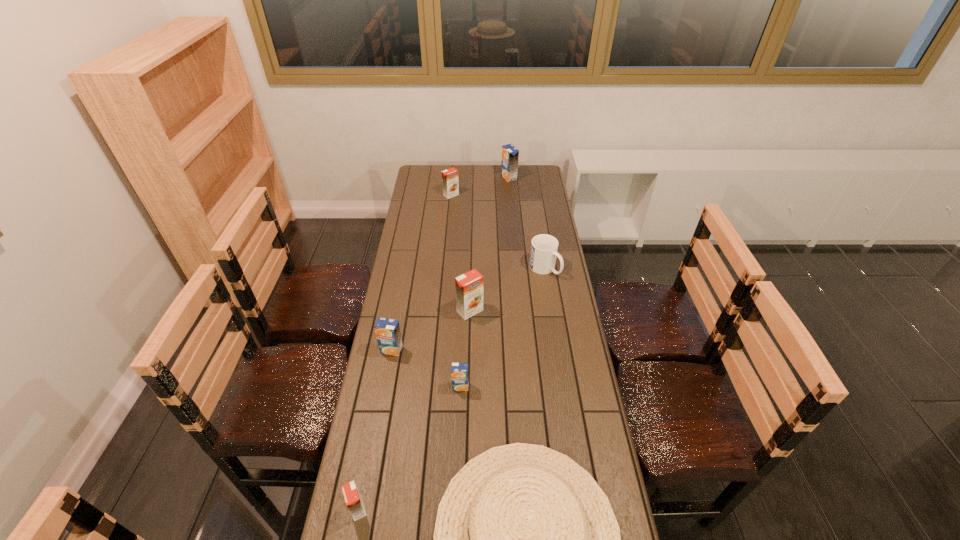
Locate an element on the screen. The width and height of the screenshot is (960, 540). vacant area that lies between the second farthest orange orange juice and the farthest object is located at coordinates (490, 244).

Identify the location of free space between the fourth nearest orange juice and the nearest orange orange juice. (414, 410).

In order to click on vacant area between the farthest orange juice and the mug in this screenshot , I will do click(x=527, y=223).

You are a GUI agent. You are given a task and a screenshot of the screen. Output one action in this format:
    pyautogui.click(x=<x>, y=<y>)
    Task: Click on the free spot between the second blue orange_juice from left to right and the farthest orange orange juice
    
    Given the screenshot: What is the action you would take?
    pyautogui.click(x=456, y=291)

Find the location of a particular element. The height and width of the screenshot is (540, 960). empty space that is in between the smallest orange orange juice and the fifth nearest orange juice is located at coordinates (404, 352).

Identify the location of vacant area that lies between the second farthest orange juice and the fourth nearest orange juice. The width and height of the screenshot is (960, 540). (461, 253).

Locate an element on the screen. free space between the fourth farthest orange juice and the farthest object is located at coordinates (450, 264).

The height and width of the screenshot is (540, 960). I want to click on unoccupied position between the blue mug and the second farthest orange orange juice, so click(507, 290).

You are a GUI agent. You are given a task and a screenshot of the screen. Output one action in this format:
    pyautogui.click(x=<x>, y=<y>)
    Task: Click on the seventh closest object to the rightmost orange orange juice
    
    Given the screenshot: What is the action you would take?
    pyautogui.click(x=510, y=154)

Select which object is the fourth closest to the shortest object. Please provide its 2D coordinates. Your answer should be formatted as a tuple, i.e. [(x, y)], where the tuple contains the x and y coordinates of a point satisfying the conditions above.

[(469, 286)]